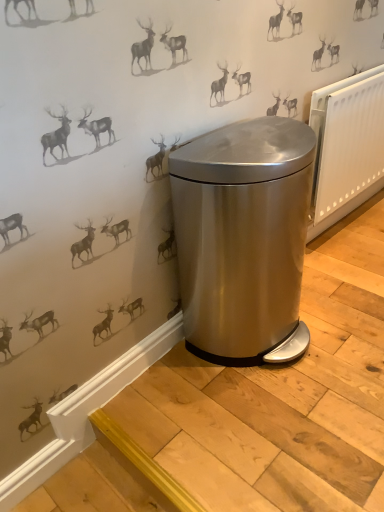
Question: Can you confirm if satin silver trash can at center is positioned to the right of white plastic radiator at right?

Choices:
 (A) no
 (B) yes

Answer: (A)

Question: Can white plastic radiator at right be found inside satin silver trash can at center?

Choices:
 (A) yes
 (B) no

Answer: (B)

Question: Is satin silver trash can at center positioned far away from white plastic radiator at right?

Choices:
 (A) no
 (B) yes

Answer: (A)

Question: From the image's perspective, is satin silver trash can at center beneath white plastic radiator at right?

Choices:
 (A) no
 (B) yes

Answer: (B)

Question: Does satin silver trash can at center have a larger size compared to white plastic radiator at right?

Choices:
 (A) no
 (B) yes

Answer: (B)

Question: Considering the relative sizes of satin silver trash can at center and white plastic radiator at right in the image provided, is satin silver trash can at center taller than white plastic radiator at right?

Choices:
 (A) yes
 (B) no

Answer: (A)

Question: From a real-world perspective, does white plastic radiator at right stand above satin silver trash can at center?

Choices:
 (A) yes
 (B) no

Answer: (A)

Question: Is white plastic radiator at right closer to camera compared to satin silver trash can at center?

Choices:
 (A) yes
 (B) no

Answer: (B)

Question: Can you confirm if white plastic radiator at right is taller than satin silver trash can at center?

Choices:
 (A) yes
 (B) no

Answer: (B)

Question: From a real-world perspective, is white plastic radiator at right beneath satin silver trash can at center?

Choices:
 (A) yes
 (B) no

Answer: (B)

Question: Is the depth of white plastic radiator at right greater than that of satin silver trash can at center?

Choices:
 (A) no
 (B) yes

Answer: (B)

Question: Can we say white plastic radiator at right lies outside satin silver trash can at center?

Choices:
 (A) no
 (B) yes

Answer: (B)

Question: Based on their positions, is satin silver trash can at center located to the left or right of white plastic radiator at right?

Choices:
 (A) left
 (B) right

Answer: (A)